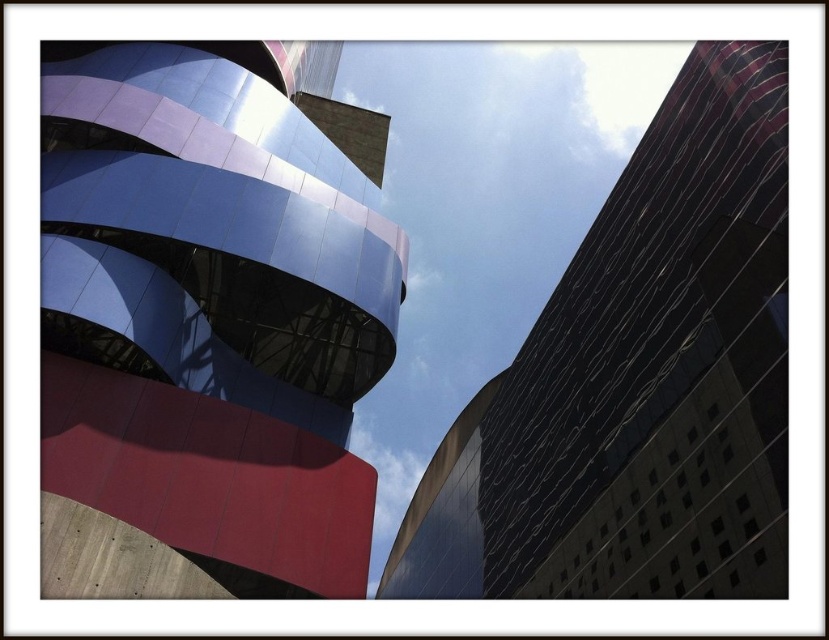
Is point (143, 497) more distant than point (502, 474)?

No, it is not.

This screenshot has width=829, height=640. Describe the element at coordinates (204, 326) in the screenshot. I see `metallic blue building at upper left` at that location.

Locate an element on the screen. metallic blue building at upper left is located at coordinates (204, 326).